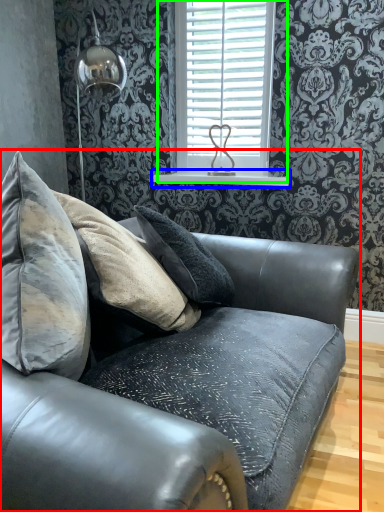
Question: Estimate the real-world distances between objects in this image. Which object is closer to studio couch (highlighted by a red box), window sill (highlighted by a blue box) or window (highlighted by a green box)?

Choices:
 (A) window sill
 (B) window

Answer: (B)